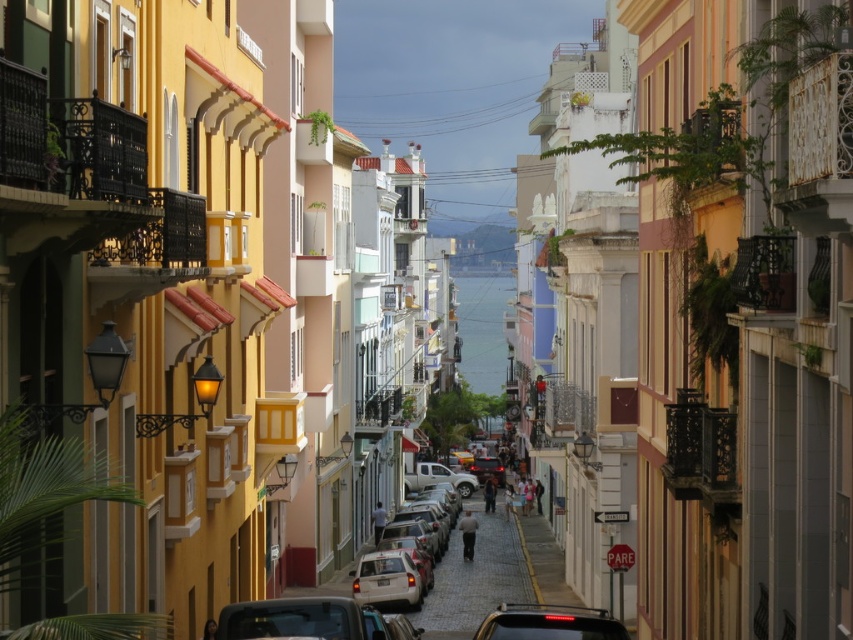
Locate an element on the screen. The height and width of the screenshot is (640, 853). shiny black car at lower center is located at coordinates (300, 620).

Is shiny black car at lower center wider than matte silver car at center?

Indeed, shiny black car at lower center has a greater width compared to matte silver car at center.

Does point (408, 632) lie in front of point (409, 564)?

Yes.

Where is `shiny black car at lower center`? shiny black car at lower center is located at coordinates (300, 620).

Is matte black car at center positioned at the back of matte silver car at center?

No, it is in front of matte silver car at center.

Who is positioned more to the left, matte black car at center or matte silver car at center?

From the viewer's perspective, matte silver car at center appears more on the left side.

Which is behind, point (526, 636) or point (364, 560)?

Positioned behind is point (364, 560).

Where is `matte black car at center`? matte black car at center is located at coordinates (548, 621).

Is shiny black car at lower center taller than matte black car at center?

In fact, shiny black car at lower center may be shorter than matte black car at center.

Is shiny black car at lower center below matte black car at center?

Actually, shiny black car at lower center is above matte black car at center.

Who is more distant from viewer, (350, 625) or (611, 637)?

The point (350, 625) is behind.

Find the location of a particular element. shiny black car at lower center is located at coordinates (300, 620).